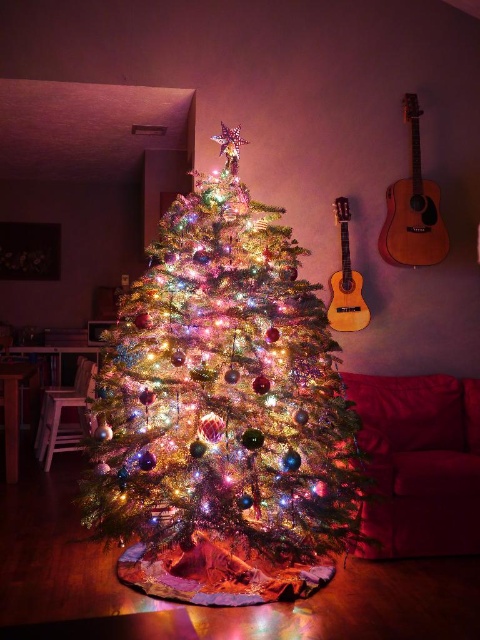
Question: Is iridescent shiny tree at center bigger than light brown wooden guitar at right?

Choices:
 (A) no
 (B) yes

Answer: (B)

Question: Which point appears closest to the camera in this image?

Choices:
 (A) (437, 260)
 (B) (156, 244)

Answer: (B)

Question: Based on their relative distances, which object is farther from the wooden acoustic guitar at right?

Choices:
 (A) light brown wooden guitar at right
 (B) iridescent shiny tree at center

Answer: (B)

Question: Which is nearer to the wooden acoustic guitar at right?

Choices:
 (A) iridescent shiny tree at center
 (B) light brown wooden guitar at right

Answer: (B)

Question: Can you confirm if iridescent shiny tree at center is positioned to the right of light brown wooden guitar at right?

Choices:
 (A) no
 (B) yes

Answer: (A)

Question: Is wooden acoustic guitar at right further to camera compared to light brown wooden guitar at right?

Choices:
 (A) no
 (B) yes

Answer: (B)